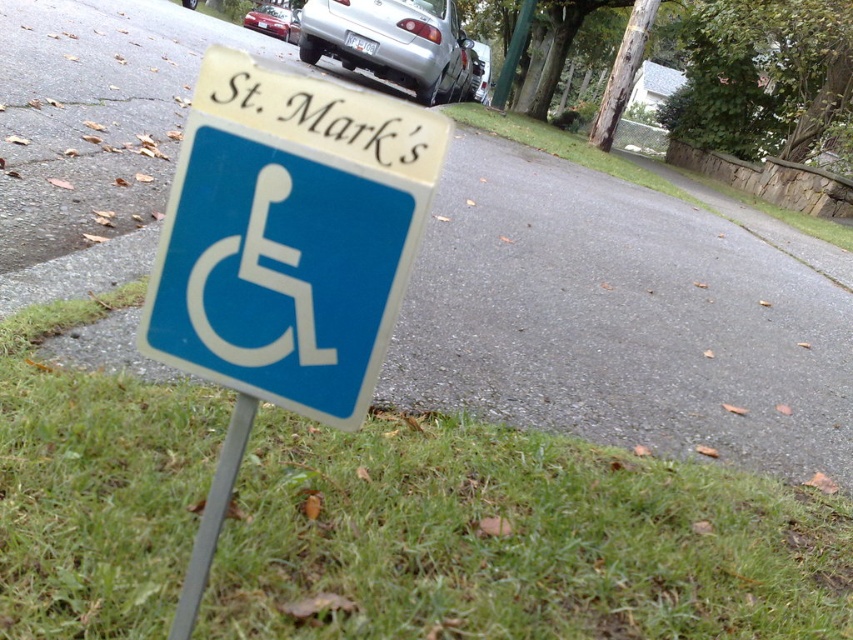
Question: Which point is farther to the camera?

Choices:
 (A) metallic silver sedan at upper center
 (B) metallic pole at lower center
 (C) blue plastic sign at center

Answer: (A)

Question: Which is nearer to the blue plastic sign at center?

Choices:
 (A) green grass at lower left
 (B) metallic pole at lower center
 (C) silver metallic car at center

Answer: (B)

Question: Is blue plastic sign at center bigger than metallic silver sedan at upper center?

Choices:
 (A) no
 (B) yes

Answer: (A)

Question: Among these objects, which one is nearest to the camera?

Choices:
 (A) silver metallic car at upper center
 (B) metallic pole at lower center
 (C) green grass at lower left
 (D) blue plastic sign at center

Answer: (D)

Question: Can you confirm if metallic silver sedan at upper center is smaller than silver metallic car at center?

Choices:
 (A) yes
 (B) no

Answer: (B)

Question: Can you confirm if silver metallic car at upper center is smaller than metallic silver sedan at upper center?

Choices:
 (A) yes
 (B) no

Answer: (A)